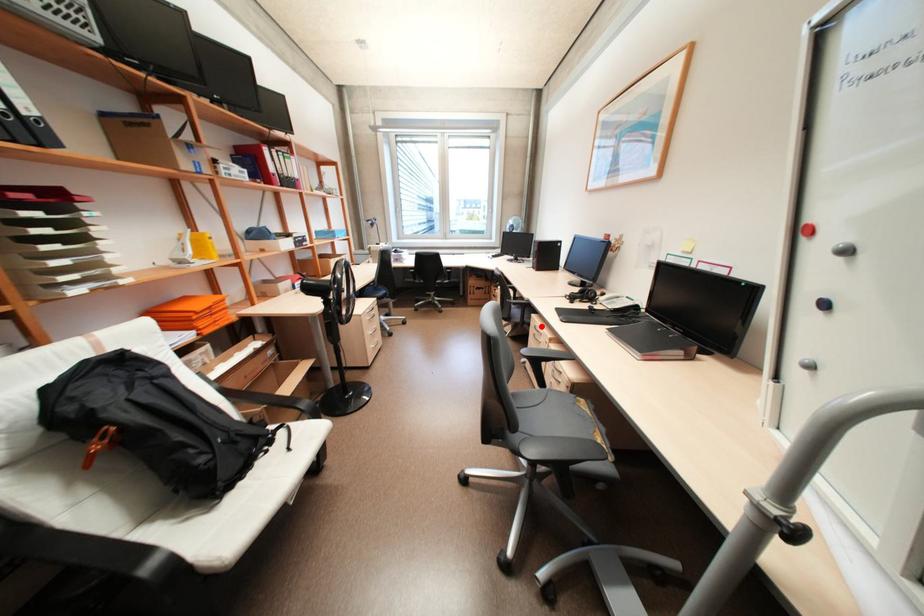
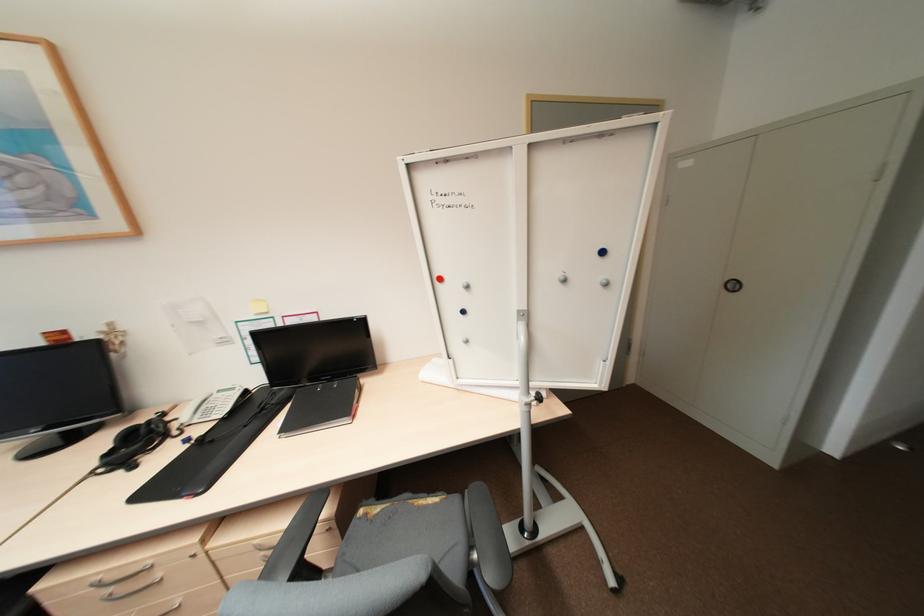
Question: I am providing you with two images of the same scene from different viewpoints. Given a red point in image1, look at the same physical point in image2. Is it:

Choices:
 (A) Closer to the viewpoint
 (B) Farther from the viewpoint

Answer: (A)